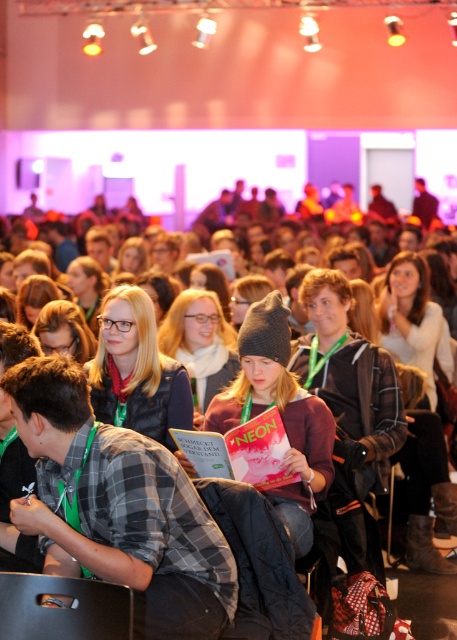
Question: Among these objects, which one is nearest to the camera?

Choices:
 (A) matte gray beanie at center
 (B) knit gray beanie at center

Answer: (B)

Question: Which is farther from the knit gray beanie at center?

Choices:
 (A) matte gray beanie at center
 (B) matte black vest at center

Answer: (A)

Question: Is the position of knit gray beanie at center less distant than that of matte black vest at center?

Choices:
 (A) yes
 (B) no

Answer: (A)

Question: Which point is farther to the camera?

Choices:
 (A) matte gray beanie at center
 (B) knit gray beanie at center

Answer: (A)

Question: Observing the image, what is the correct spatial positioning of knit gray beanie at center in reference to matte black vest at center?

Choices:
 (A) left
 (B) right

Answer: (B)

Question: Does matte black vest at center have a larger size compared to matte gray beanie at center?

Choices:
 (A) yes
 (B) no

Answer: (B)